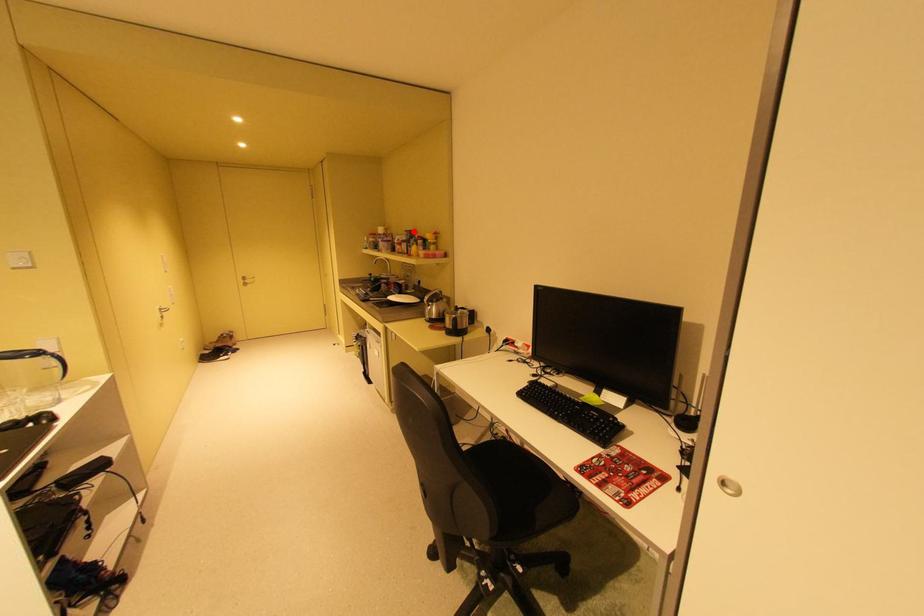
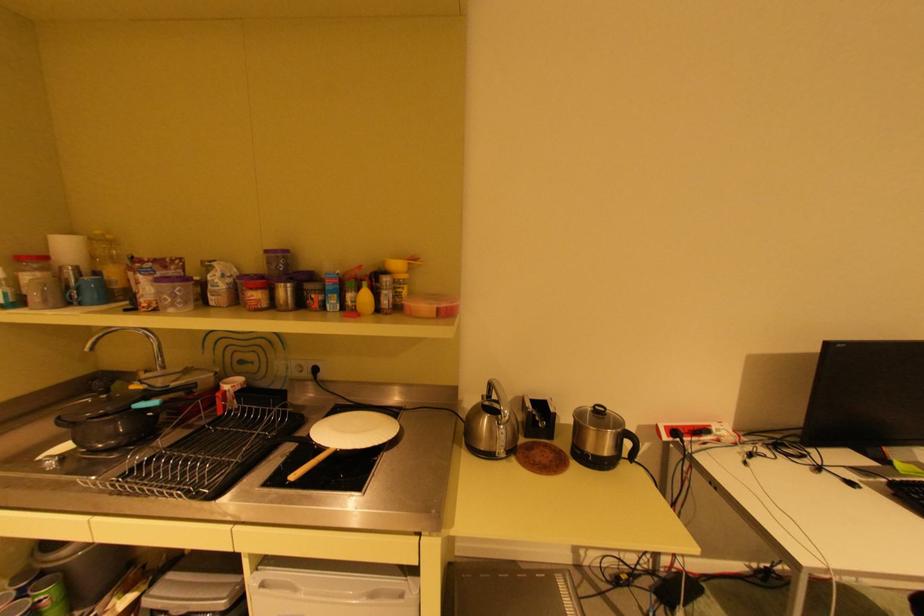
Find the pixel in the second image that matches the highlighted location in the first image.

(274, 251)